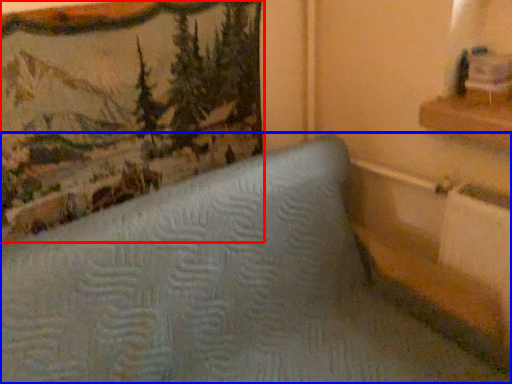
Question: Which point is further to the camera, picture frame (highlighted by a red box) or furniture (highlighted by a blue box)?

Choices:
 (A) picture frame
 (B) furniture

Answer: (A)